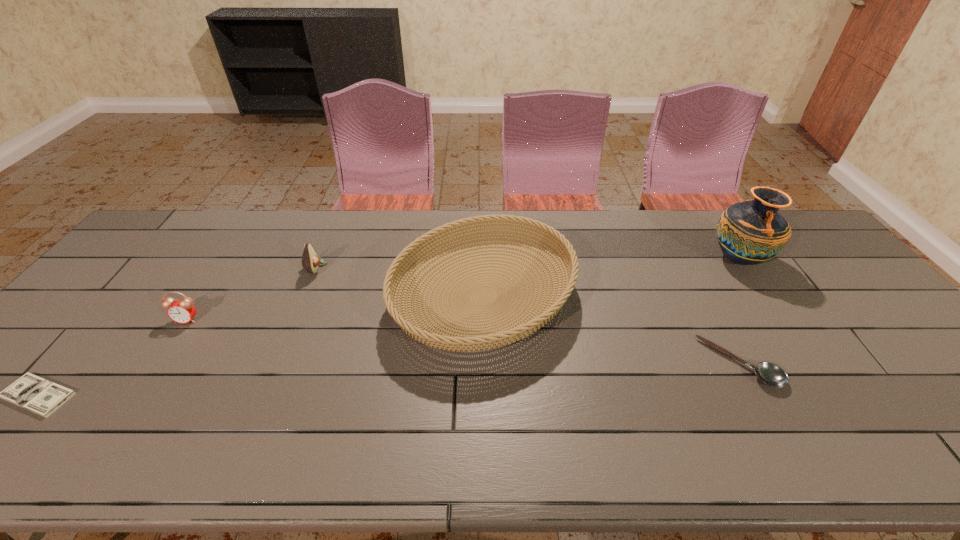
Locate an element on the screen. Image resolution: width=960 pixels, height=540 pixels. vacant space located on the back of the ladle is located at coordinates (682, 255).

Locate an element on the screen. The width and height of the screenshot is (960, 540). pottery situated at the far edge is located at coordinates (751, 232).

In order to click on basket that is at the far edge in this screenshot , I will do `click(498, 332)`.

You are a GUI agent. You are given a task and a screenshot of the screen. Output one action in this format:
    pyautogui.click(x=<x>, y=<y>)
    Task: Click on the free space at the far edge of the desktop
    The height and width of the screenshot is (540, 960).
    Given the screenshot: What is the action you would take?
    pyautogui.click(x=310, y=228)

In the image, there is a desktop. Where is `vacant space at the near edge`? Image resolution: width=960 pixels, height=540 pixels. vacant space at the near edge is located at coordinates (721, 429).

Find the location of a particular element. The height and width of the screenshot is (540, 960). vacant space at the left edge is located at coordinates coord(145,285).

This screenshot has width=960, height=540. Identify the location of vacant space at the right edge of the desktop. (852, 291).

Where is `free space between the pottery and the ladle`? The image size is (960, 540). free space between the pottery and the ladle is located at coordinates (739, 311).

What are the coordinates of `vacant area between the fourth object from left to right and the pottery` in the screenshot? It's located at (611, 278).

I want to click on free space between the tallest object and the fourth object from left to right, so click(x=611, y=278).